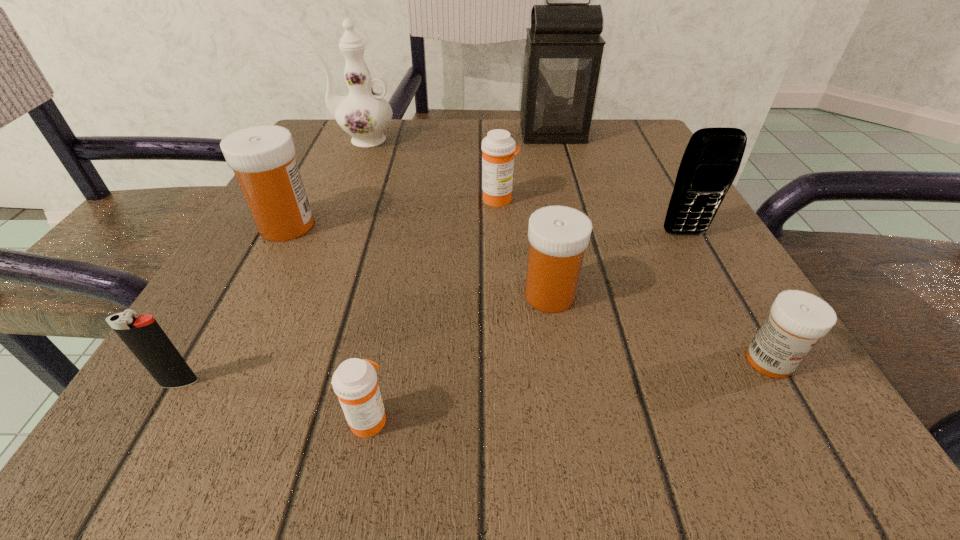
Locate an element on the screen. This screenshot has height=540, width=960. black igniter is located at coordinates (145, 338).

The height and width of the screenshot is (540, 960). In order to click on the fourth farthest medicine in this screenshot , I will do `click(797, 320)`.

I want to click on the rightmost white medicine, so click(x=797, y=320).

I want to click on the nearest medicine, so click(x=354, y=382).

The width and height of the screenshot is (960, 540). I want to click on the nearest object, so click(354, 382).

Locate an element on the screen. vacant position located on the front-facing side of the tallest object is located at coordinates (573, 210).

Where is `vacant position located on the screen of the cellular telephone`? vacant position located on the screen of the cellular telephone is located at coordinates (730, 316).

Locate an element on the screen. This screenshot has width=960, height=540. vacant space located 0.260m on the front of the farthest white medicine is located at coordinates (199, 390).

Locate an element on the screen. free space located 0.180m on the right of the farthest medicine is located at coordinates (619, 199).

Find the location of a particular element. vacant position located on the back of the second white medicine from left to right is located at coordinates (535, 199).